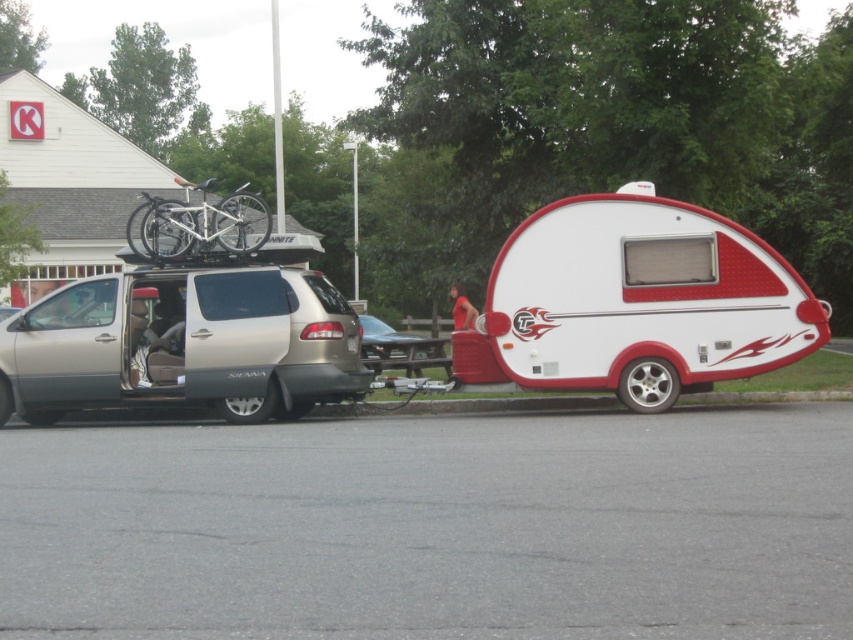
You are a delivery person trying to load a package onto the white matte camper at center. The package requires a height clearance of 2 meters. Can you determine if the white matte bicycle at upper left will interfere with the loading process?

The white matte bicycle at upper left is taller than the white matte camper at center. Since the package requires a height clearance of 2 meters, the bicycle might interfere if its height exceeds 2 meters. However, the description only states the camper is shorter than the bicycle, not the exact height of the bicycle. Without knowing the bicycle height, it is uncertain if it will interfere.

You are standing at the camera position and want to walk to the white matte camper at center. How many steps would you need to take if each step covers 2.5 feet?

The distance between the camera and the white matte camper at center is 48.08 feet. Dividing this by 2.5 feet per step gives approximately 19.23 steps. Since you can only take whole steps, you would need to take 20 steps to reach the white matte camper at center.

You are standing in the parking lot and want to walk from the white matte camper at center to the satin silver van at left. Which direction should you go?

To go from the white matte camper at center to the satin silver van at left, you should walk to the left since the satin silver van at left is positioned to the left of the white matte camper at center.